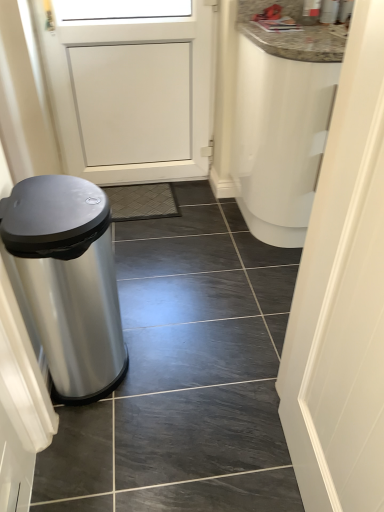
Question: In terms of height, does white matte door at right look taller or shorter compared to slate tile at left?

Choices:
 (A) short
 (B) tall

Answer: (B)

Question: Is white matte door at right to the left or to the right of slate tile at left in the image?

Choices:
 (A) right
 (B) left

Answer: (A)

Question: Which is nearer to the polished stainless steel trash can at left?

Choices:
 (A) white matte door at right
 (B) slate tile at left

Answer: (B)

Question: Which of these objects is positioned closest to the slate tile at left?

Choices:
 (A) white matte door at right
 (B) polished stainless steel trash can at left

Answer: (B)